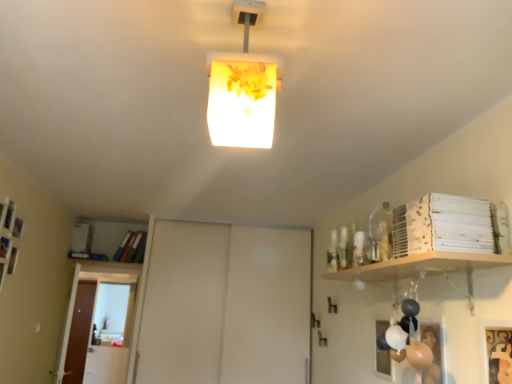
Question: From a real-world perspective, relative to brown wooden door at left, the 2th door positioned from the right, is translucent floral-patterned lampshade at center vertically above or below?

Choices:
 (A) above
 (B) below

Answer: (A)

Question: Is translucent floral-patterned lampshade at center wider or thinner than brown wooden door at left, the 2th door positioned from the right?

Choices:
 (A) wide
 (B) thin

Answer: (A)

Question: Which is nearer to the translucent floral-patterned lampshade at center?

Choices:
 (A) gold textured picture frame at lower right
 (B) brown wooden door at left, the second door positioned from the front
 (C) transparent glass door at lower left
 (D) white matte sliding door at center, which is the first door from right to left

Answer: (A)

Question: Estimate the real-world distances between objects in this image. Which object is farther from the brown wooden door at left, the 2th door positioned from the right?

Choices:
 (A) white matte sliding door at center, which is the first door from right to left
 (B) translucent floral-patterned lampshade at center
 (C) transparent glass door at lower left
 (D) gold textured picture frame at lower right

Answer: (D)